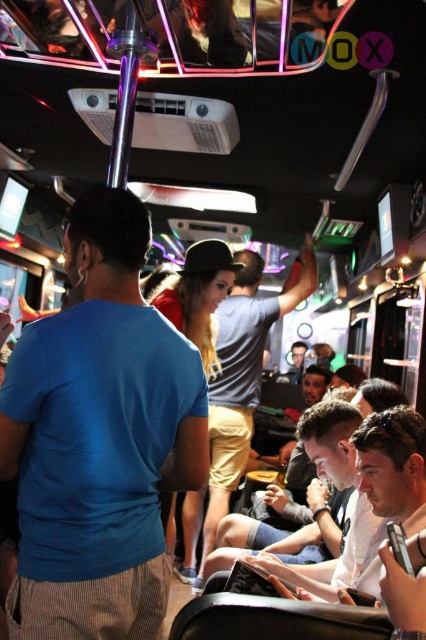
Who is higher up, blue cotton shirt at center or smooth skin face at center?

Positioned higher is blue cotton shirt at center.

Is blue cotton shirt at center to the left of smooth skin face at center from the viewer's perspective?

Yes, blue cotton shirt at center is to the left of smooth skin face at center.

Who is more distant from viewer, (109, 557) or (359, 534)?

The point (359, 534) is more distant.

I want to click on blue cotton shirt at center, so pos(98,438).

Is matte black hat at center shorter than smooth skin face at center?

No, matte black hat at center is not shorter than smooth skin face at center.

Image resolution: width=426 pixels, height=640 pixels. What do you see at coordinates (236, 392) in the screenshot?
I see `matte black hat at center` at bounding box center [236, 392].

Is point (209, 385) closer to camera compared to point (354, 408)?

No, it is behind (354, 408).

The height and width of the screenshot is (640, 426). I want to click on matte black hat at center, so [x=236, y=392].

Who is higher up, blue cotton shirt at center or matte black hat at center?

blue cotton shirt at center is above.

Does blue cotton shirt at center appear on the right side of matte black hat at center?

In fact, blue cotton shirt at center is to the left of matte black hat at center.

What do you see at coordinates (98, 438) in the screenshot? The width and height of the screenshot is (426, 640). I see `blue cotton shirt at center` at bounding box center [98, 438].

I want to click on blue cotton shirt at center, so click(98, 438).